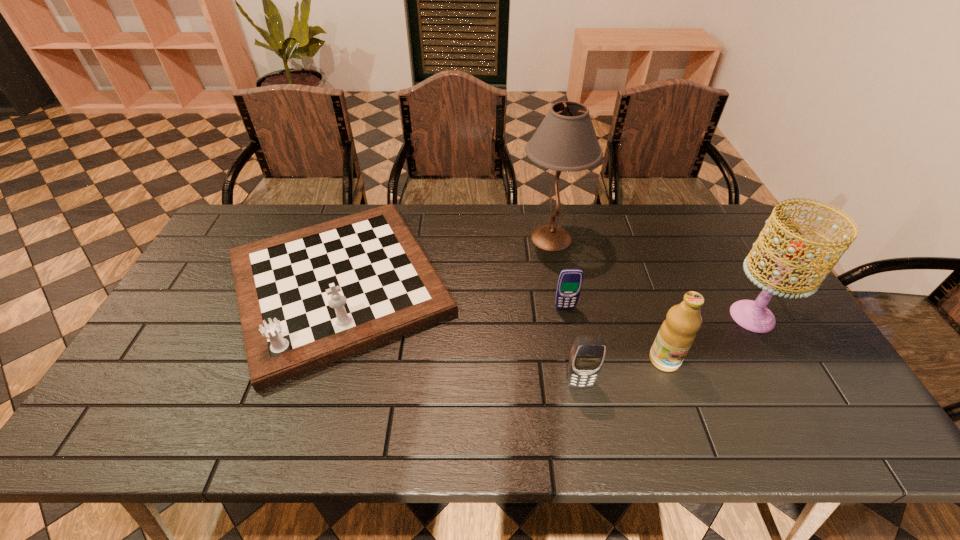
Where is `vacant area located 0.390m on the front-facing side of the table lamp`? This screenshot has height=540, width=960. vacant area located 0.390m on the front-facing side of the table lamp is located at coordinates (401, 238).

In order to click on vacant area located on the front-facing side of the table lamp in this screenshot , I will do `click(482, 238)`.

Locate an element on the screen. The image size is (960, 540). free point located on the left of the rightmost object is located at coordinates (667, 316).

Locate an element on the screen. The width and height of the screenshot is (960, 540). free spot located 0.170m on the label of the olive oil is located at coordinates (692, 438).

Identify the location of vacant space located on the right of the gameboard. Image resolution: width=960 pixels, height=540 pixels. (573, 285).

Where is `free spot located on the front face of the nearer cellular telephone`? This screenshot has width=960, height=540. free spot located on the front face of the nearer cellular telephone is located at coordinates (588, 424).

At what (x,y) coordinates should I click in order to perform the action: click on free location located on the front-facing side of the farther cellular telephone. Please return your answer as a coordinate pair (x, y). Looking at the image, I should click on coord(585,418).

You are a GUI agent. You are given a task and a screenshot of the screen. Output one action in this format:
    pyautogui.click(x=<x>, y=<y>)
    Task: Click on the table lamp located at the far edge
    The height and width of the screenshot is (540, 960).
    Given the screenshot: What is the action you would take?
    pyautogui.click(x=566, y=140)

Image resolution: width=960 pixels, height=540 pixels. In order to click on gameboard at the far edge in this screenshot , I will do `click(308, 298)`.

Where is `object positioned at the left edge`? This screenshot has width=960, height=540. object positioned at the left edge is located at coordinates (308, 298).